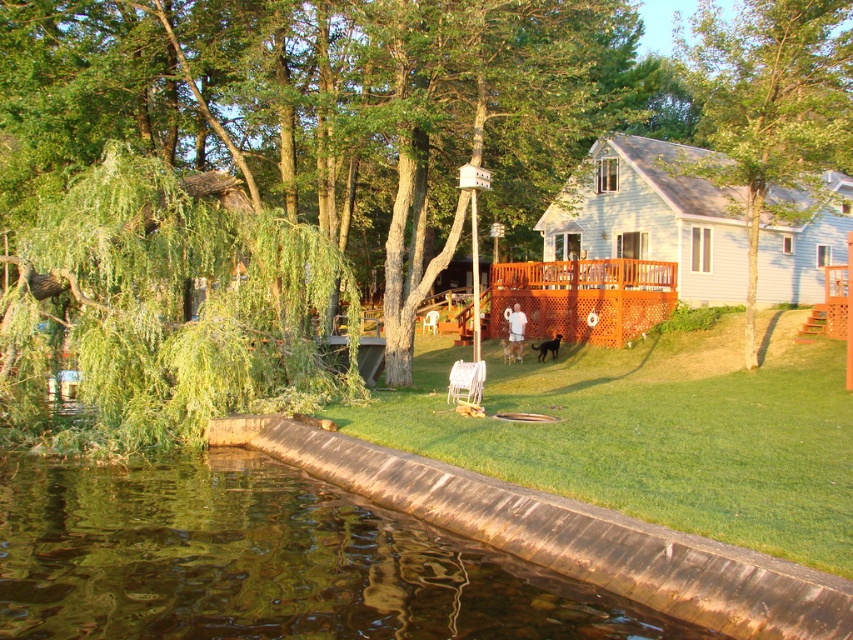
The image size is (853, 640). I want to click on green leafy tree at left, so pos(167,310).

Which is behind, point (86, 352) or point (700, 52)?

The point (700, 52) is behind.

Does point (206, 337) lie behind point (755, 218)?

That is False.

In order to click on green leafy tree at left in this screenshot , I will do `click(167, 310)`.

Can you confirm if brown concrete water at lower left is positioned to the right of green leafy tree at center?

No, brown concrete water at lower left is not to the right of green leafy tree at center.

Image resolution: width=853 pixels, height=640 pixels. Identify the location of brown concrete water at lower left. (263, 561).

Who is more forward, (x=300, y=609) or (x=746, y=56)?

Point (x=300, y=609) is more forward.

You are a GUI agent. You are given a task and a screenshot of the screen. Output one action in this format:
    pyautogui.click(x=<x>, y=<y>)
    Task: Click on the brown concrete water at lower left
    This screenshot has height=640, width=853.
    Given the screenshot: What is the action you would take?
    pyautogui.click(x=263, y=561)

Between brown lattice deck at center and white plastic chair at center, which one has less height?

Standing shorter between the two is white plastic chair at center.

Between brown lattice deck at center and white plastic chair at center, which one appears on the right side from the viewer's perspective?

From the viewer's perspective, brown lattice deck at center appears more on the right side.

At what (x,y) coordinates should I click in order to perform the action: click on brown lattice deck at center. Please return your answer as a coordinate pair (x, y). This screenshot has height=640, width=853. Looking at the image, I should click on (584, 298).